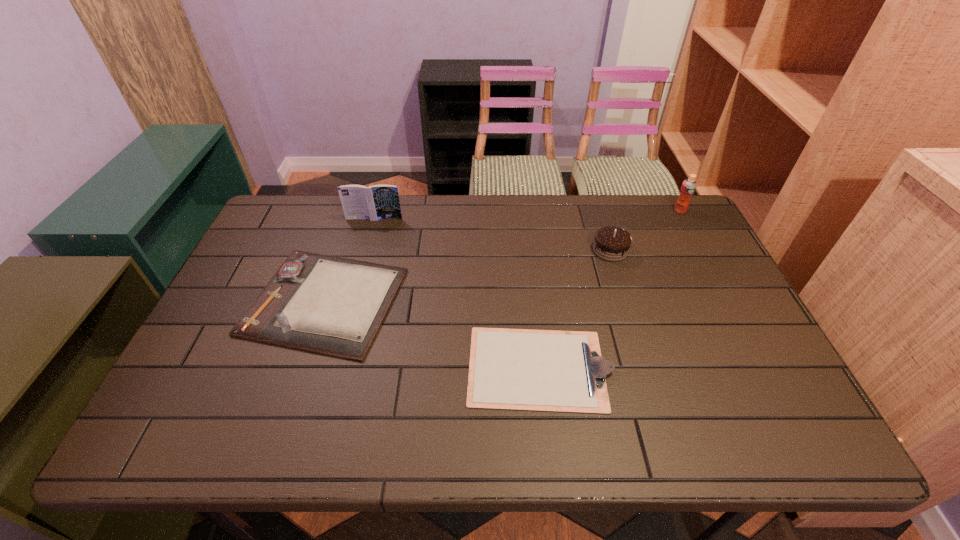
The height and width of the screenshot is (540, 960). Find the location of `free spot located on the right of the left clipboard`. free spot located on the right of the left clipboard is located at coordinates (500, 301).

Locate an element on the screen. This screenshot has height=540, width=960. vacant space located on the back of the right clipboard is located at coordinates (525, 241).

Where is `orange juice that is at the far edge`? orange juice that is at the far edge is located at coordinates (688, 187).

Where is `book present at the far edge`? book present at the far edge is located at coordinates (376, 202).

You are a GUI agent. You are given a task and a screenshot of the screen. Output one action in this format:
    pyautogui.click(x=<x>, y=<y>)
    Task: Click on the chocolate cake that is positioned at the far edge
    The image size is (960, 540).
    Given the screenshot: What is the action you would take?
    coord(611,243)

Find the location of `object that is at the near edge`. object that is at the near edge is located at coordinates (511, 369).

You are a GUI agent. You are given a task and a screenshot of the screen. Output one action in this format:
    pyautogui.click(x=<x>, y=<y>)
    Task: Click on the object positioned at the left edge
    
    Given the screenshot: What is the action you would take?
    pyautogui.click(x=324, y=304)

Identify the location of object positioned at the right edge. This screenshot has width=960, height=540. (688, 187).

The height and width of the screenshot is (540, 960). What are the coordinates of `object located in the far right corner section of the desktop` in the screenshot? It's located at (688, 187).

The height and width of the screenshot is (540, 960). What are the coordinates of `vacant space at the far edge` in the screenshot? It's located at (416, 208).